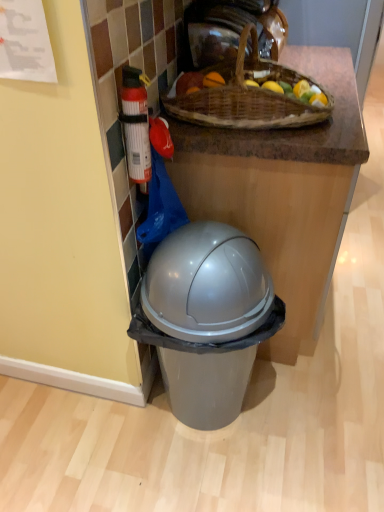
Where is `brown woven picnic basket at upper center`? brown woven picnic basket at upper center is located at coordinates (247, 96).

This screenshot has height=512, width=384. Describe the element at coordinates (247, 96) in the screenshot. I see `brown woven picnic basket at upper center` at that location.

In order to face brown woven picnic basket at upper center, should I rotate leftwards or rightwards?

To face it directly, rotate right by 9.231 degrees.

This screenshot has width=384, height=512. What do you see at coordinates (136, 126) in the screenshot?
I see `white plastic fire extinguisher at left` at bounding box center [136, 126].

Locate an element on the screen. The width and height of the screenshot is (384, 512). white plastic fire extinguisher at left is located at coordinates (136, 126).

This screenshot has width=384, height=512. What are the coordinates of `brown woven picnic basket at upper center` in the screenshot? It's located at [247, 96].

Considering the relative positions of brown woven picnic basket at upper center and white plastic fire extinguisher at left in the image provided, is brown woven picnic basket at upper center to the left of white plastic fire extinguisher at left from the viewer's perspective?

Incorrect, brown woven picnic basket at upper center is not on the left side of white plastic fire extinguisher at left.

Is brown woven picnic basket at upper center in front of white plastic fire extinguisher at left?

That is False.

Which point is more forward, (255, 105) or (137, 136)?

Point (137, 136)

From the picture: From the image's perspective, is brown woven picnic basket at upper center beneath white plastic fire extinguisher at left?

Actually, brown woven picnic basket at upper center appears above white plastic fire extinguisher at left in the image.

From a real-world perspective, is brown woven picnic basket at upper center below white plastic fire extinguisher at left?

Incorrect, from a real-world perspective, brown woven picnic basket at upper center is higher than white plastic fire extinguisher at left.

Looking at their sizes, would you say brown woven picnic basket at upper center is wider or thinner than white plastic fire extinguisher at left?

Clearly, brown woven picnic basket at upper center has more width compared to white plastic fire extinguisher at left.

Does brown woven picnic basket at upper center have a greater height compared to white plastic fire extinguisher at left?

In fact, brown woven picnic basket at upper center may be shorter than white plastic fire extinguisher at left.

Is brown woven picnic basket at upper center smaller than white plastic fire extinguisher at left?

Actually, brown woven picnic basket at upper center might be larger than white plastic fire extinguisher at left.

Consider the image. Is brown woven picnic basket at upper center not inside white plastic fire extinguisher at left?

Yes.

Is brown woven picnic basket at upper center next to white plastic fire extinguisher at left?

brown woven picnic basket at upper center and white plastic fire extinguisher at left are not in contact.

Does brown woven picnic basket at upper center turn towards white plastic fire extinguisher at left?

No, brown woven picnic basket at upper center is not turned towards white plastic fire extinguisher at left.

How many degrees apart are the facing directions of brown woven picnic basket at upper center and white plastic fire extinguisher at left?

The angular difference between brown woven picnic basket at upper center and white plastic fire extinguisher at left is 5.59 degrees.

The height and width of the screenshot is (512, 384). In the image, there is a brown woven picnic basket at upper center. Find the location of `bottle below it (from a real-world perspective)`. bottle below it (from a real-world perspective) is located at coordinates (136, 126).

Is white plastic fire extinguisher at left at the right side of brown woven picnic basket at upper center?

In fact, white plastic fire extinguisher at left is to the left of brown woven picnic basket at upper center.

Which object is more forward, white plastic fire extinguisher at left or brown woven picnic basket at upper center?

white plastic fire extinguisher at left is more forward.

Is point (144, 173) less distant than point (208, 115)?

Yes, it is.

From the image's perspective, which is below, white plastic fire extinguisher at left or brown woven picnic basket at upper center?

white plastic fire extinguisher at left.

From a real-world perspective, which is physically above, white plastic fire extinguisher at left or brown woven picnic basket at upper center?

In real-world perspective, brown woven picnic basket at upper center is above.

Which of these two, white plastic fire extinguisher at left or brown woven picnic basket at upper center, is thinner?

Thinner between the two is white plastic fire extinguisher at left.

Considering the relative sizes of white plastic fire extinguisher at left and brown woven picnic basket at upper center in the image provided, is white plastic fire extinguisher at left taller than brown woven picnic basket at upper center?

Yes.

Is white plastic fire extinguisher at left bigger or smaller than brown woven picnic basket at upper center?

Considering their sizes, white plastic fire extinguisher at left takes up less space than brown woven picnic basket at upper center.

Choose the correct answer: Is white plastic fire extinguisher at left inside brown woven picnic basket at upper center or outside it?

white plastic fire extinguisher at left is located beyond the bounds of brown woven picnic basket at upper center.

Is white plastic fire extinguisher at left with brown woven picnic basket at upper center?

No, white plastic fire extinguisher at left is not in contact with brown woven picnic basket at upper center.

Could you tell me if white plastic fire extinguisher at left is turned towards brown woven picnic basket at upper center?

No, white plastic fire extinguisher at left does not turn towards brown woven picnic basket at upper center.

Can you tell me how much white plastic fire extinguisher at left and brown woven picnic basket at upper center differ in facing direction?

The angle between the facing direction of white plastic fire extinguisher at left and the facing direction of brown woven picnic basket at upper center is 5.59 degrees.

How far apart are white plastic fire extinguisher at left and brown woven picnic basket at upper center?

The distance of white plastic fire extinguisher at left from brown woven picnic basket at upper center is 13.06 inches.

Find the location of `picnic basket above the white plastic fire extinguisher at left (from a real-world perspective)`. picnic basket above the white plastic fire extinguisher at left (from a real-world perspective) is located at coordinates (247, 96).

Locate an element on the screen. The height and width of the screenshot is (512, 384). bottle on the left of brown woven picnic basket at upper center is located at coordinates (136, 126).

Where is `bottle below the brown woven picnic basket at upper center (from a real-world perspective)`? This screenshot has height=512, width=384. bottle below the brown woven picnic basket at upper center (from a real-world perspective) is located at coordinates click(136, 126).